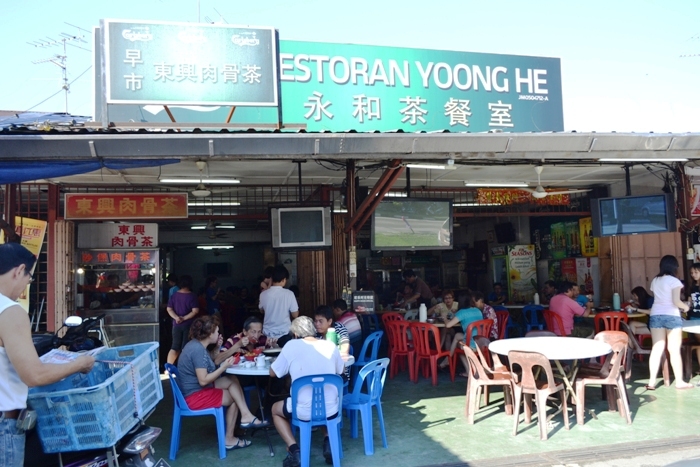
This screenshot has width=700, height=467. Identify the location of blue basket. (102, 414).